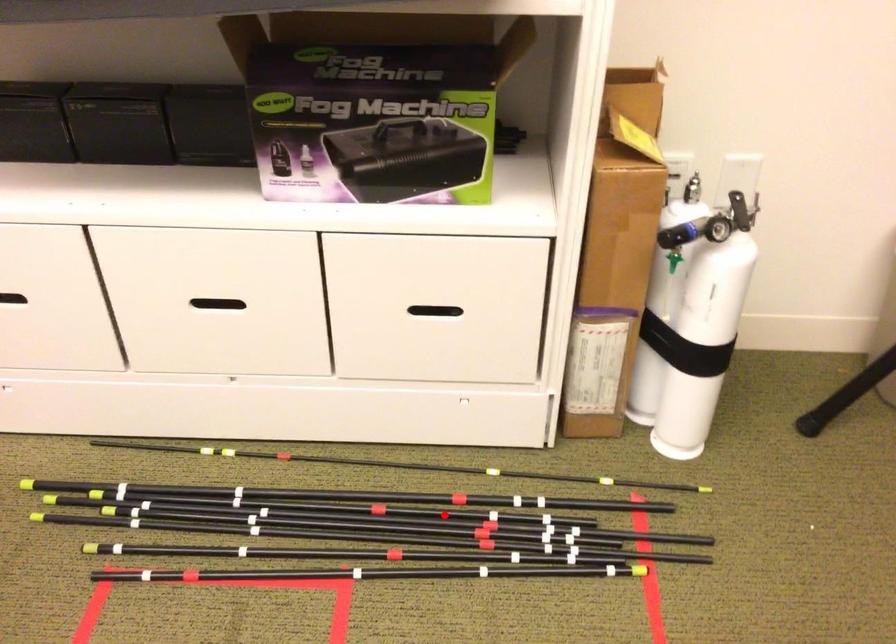
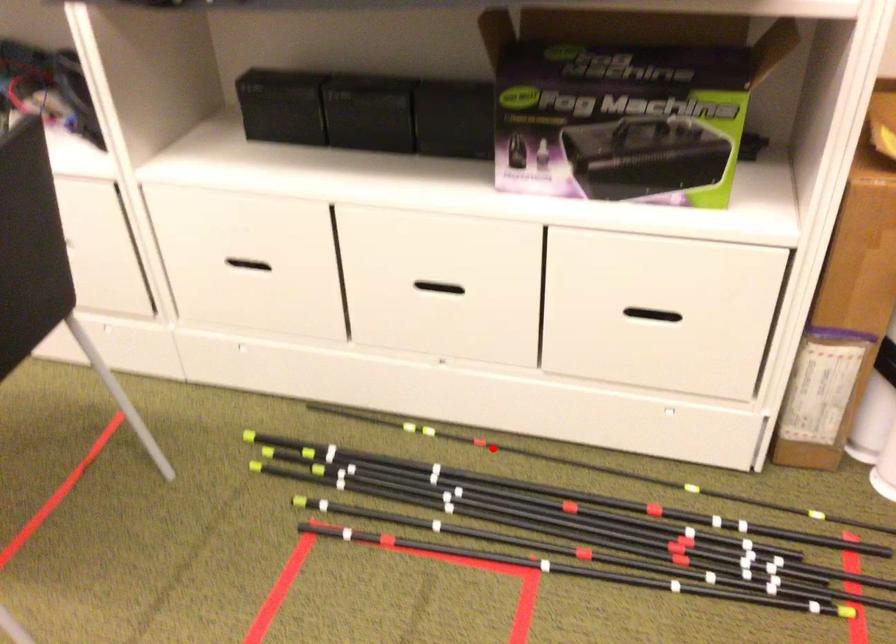
I am providing you with two images of the same scene from different viewpoints. A red point is marked on the first image and another point is marked on the second image. Are the points marked in image1 and image2 representing the same 3D position?

No